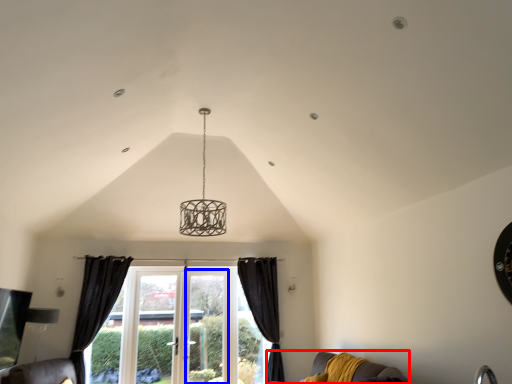
Question: Which of the following is the farthest to the observer, couch (highlighted by a red box) or screen door (highlighted by a blue box)?

Choices:
 (A) couch
 (B) screen door

Answer: (B)